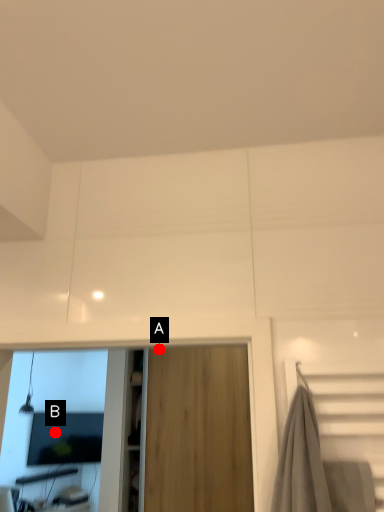
Question: Two points are circled on the image, labeled by A and B beside each circle. Which point is closer to the camera?

Choices:
 (A) A is closer
 (B) B is closer

Answer: (A)